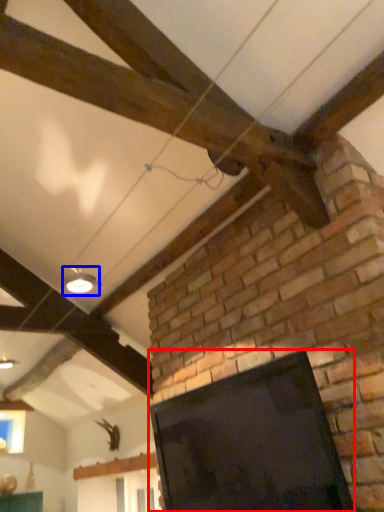
Question: Among these objects, which one is farthest to the camera, screen (highlighted by a red box) or light fixture (highlighted by a blue box)?

Choices:
 (A) screen
 (B) light fixture

Answer: (B)